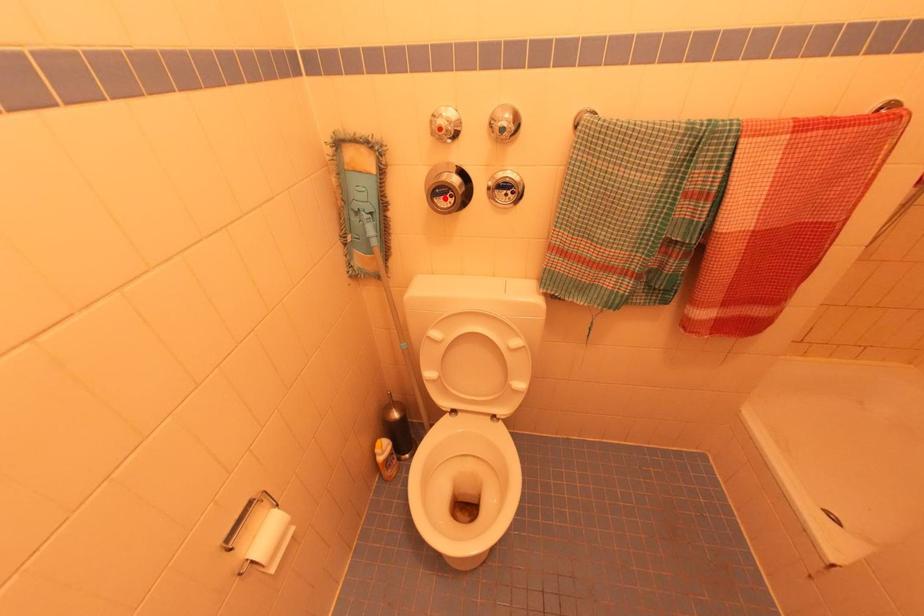
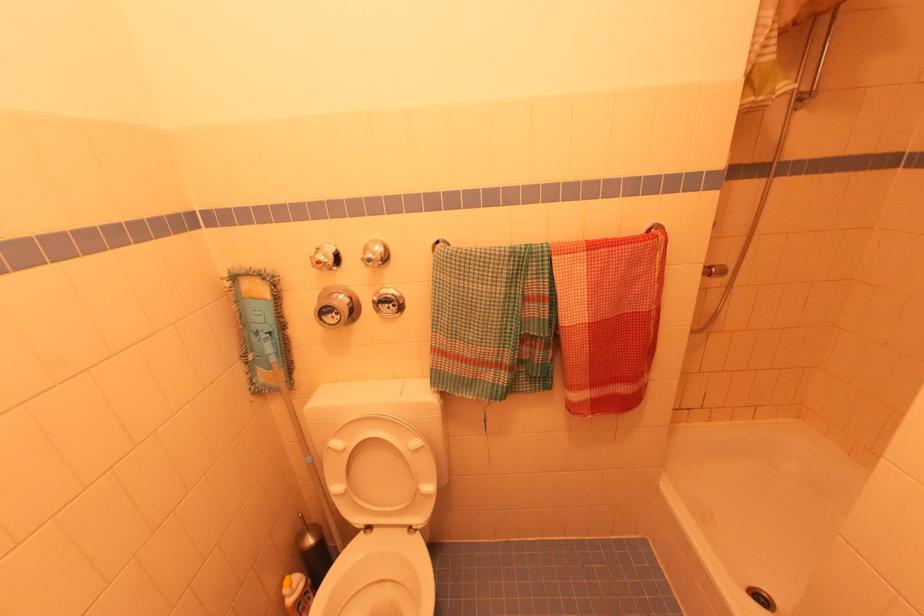
The point at the highlighted location is marked in the first image. Where is the corresponding point in the second image?

(332, 315)